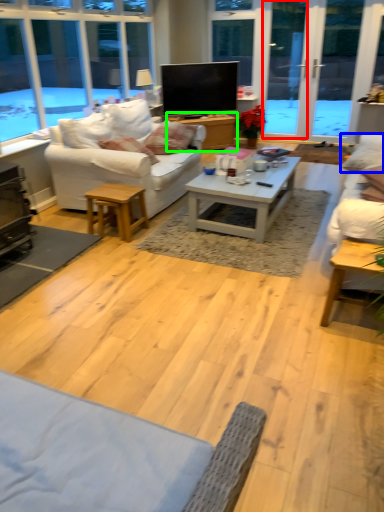
Question: Which is farther away from screen door (highlighted by a red box)? pillow (highlighted by a blue box) or table (highlighted by a green box)?

Choices:
 (A) pillow
 (B) table

Answer: (A)